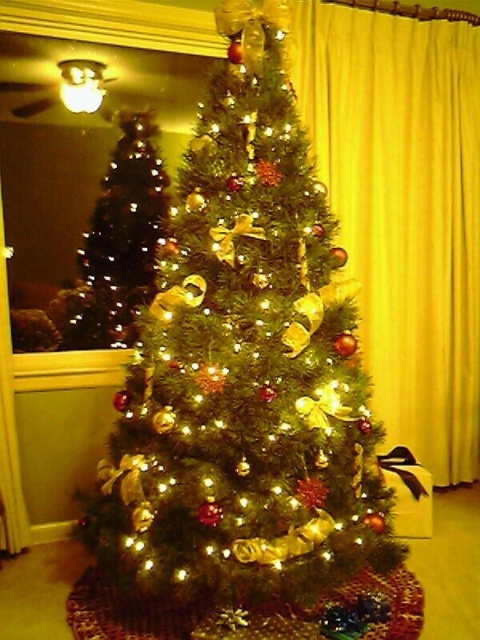
Consider the image. You are standing in front of the Christmas tree and want to place a gift under it. You have two points marked on the floor where you can place the gift. The first point is at coordinates point (350, 432) and the second is at point (433, 316). Which point is closer to you, so you can easily reach it without moving too far?

Point (350, 432) is in front of point (433, 316), so the point at (350, 432) is closer to you and easier to reach.

You are standing in the living room and want to place a new ornament on the green matte christmas tree at center. If you walk straight ahead from your current position, will you reach the tree before the point marked at coordinate (243, 371)?

The point at (243, 371) is exactly where the green matte christmas tree at center is located. Therefore, walking straight ahead will lead you directly to the tree at that coordinate.

You are standing in the living room and want to place a 3.5 feet wide gift box under the green matte christmas tree at center. Is there enough space between you and the tree to place the gift box?

The distance between you and the green matte christmas tree at center is 7.13 feet, which is more than enough space to place a 3.5 feet wide gift box.